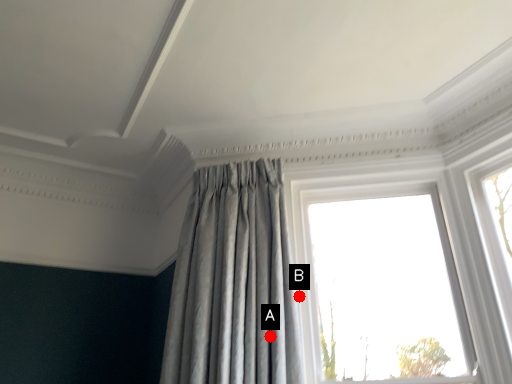
Question: Two points are circled on the image, labeled by A and B beside each circle. Which of the following is the farthest from the observer?

Choices:
 (A) A is further
 (B) B is further

Answer: (B)